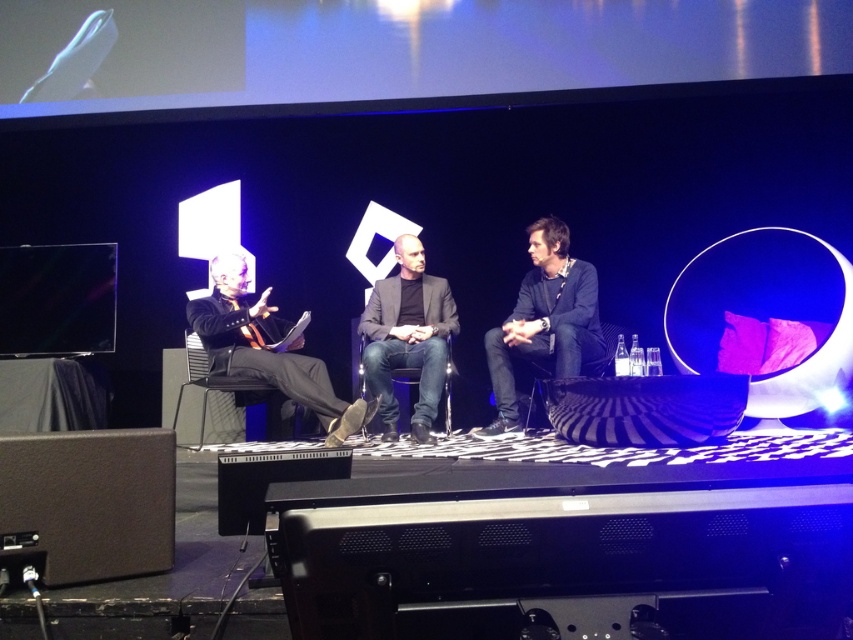
Question: Which object is the closest to the black leather chair at center?

Choices:
 (A) black leather chair at left
 (B) black fabric chair at center
 (C) black matte jacket at center

Answer: (C)

Question: Is black leather jacket at left above black fabric chair at center?

Choices:
 (A) yes
 (B) no

Answer: (B)

Question: Can you confirm if black leather jacket at left is positioned to the left of black fabric chair at center?

Choices:
 (A) yes
 (B) no

Answer: (A)

Question: Considering the real-world distances, which object is closest to the black fabric chair at center?

Choices:
 (A) black leather chair at center
 (B) black leather chair at left
 (C) black matte jacket at center
 (D) black leather jacket at left

Answer: (C)

Question: Which point is closer to the camera?

Choices:
 (A) (386, 364)
 (B) (271, 435)

Answer: (A)

Question: Observing the image, what is the correct spatial positioning of black matte jacket at center in reference to black fabric chair at center?

Choices:
 (A) above
 (B) below

Answer: (A)